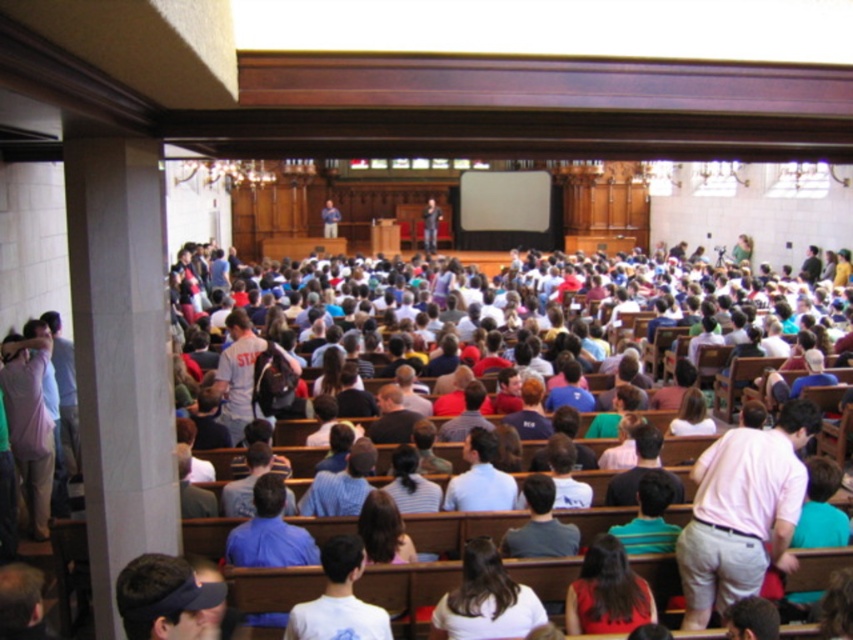
Question: Does dark brown hair at center appear on the left side of white cotton shirt at center?

Choices:
 (A) no
 (B) yes

Answer: (A)

Question: Is dark brown hair at center above light blue shirt at center?

Choices:
 (A) no
 (B) yes

Answer: (A)

Question: Which point appears farthest from the camera in this image?

Choices:
 (A) (479, 442)
 (B) (503, 600)
 (C) (592, 566)

Answer: (A)

Question: Which of the following is the closest to the observer?

Choices:
 (A) (479, 552)
 (B) (489, 500)

Answer: (A)

Question: Is dark brown hair at center further to the viewer compared to dark brown hair at lower center?

Choices:
 (A) yes
 (B) no

Answer: (B)

Question: Which point is farther to the camera?

Choices:
 (A) (579, 609)
 (B) (480, 432)

Answer: (B)